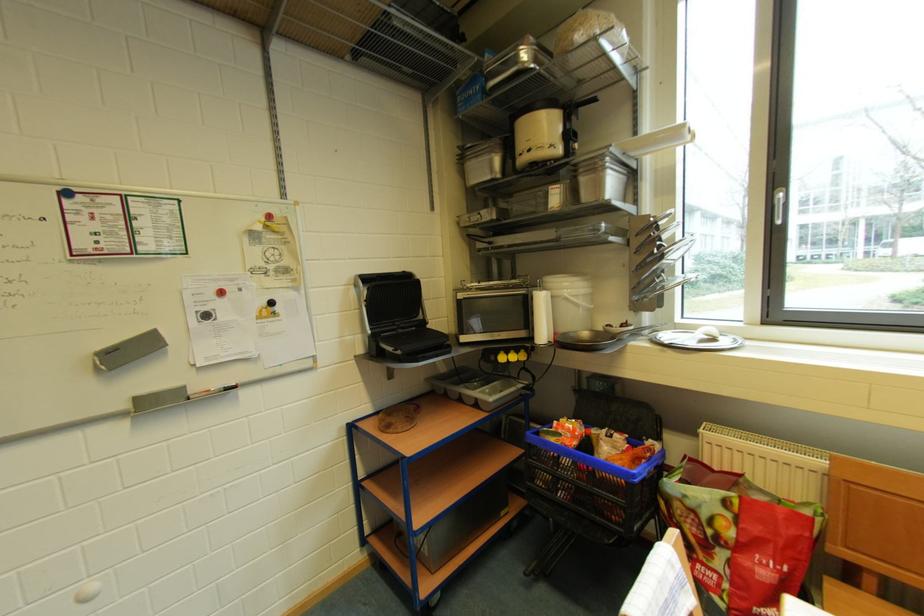
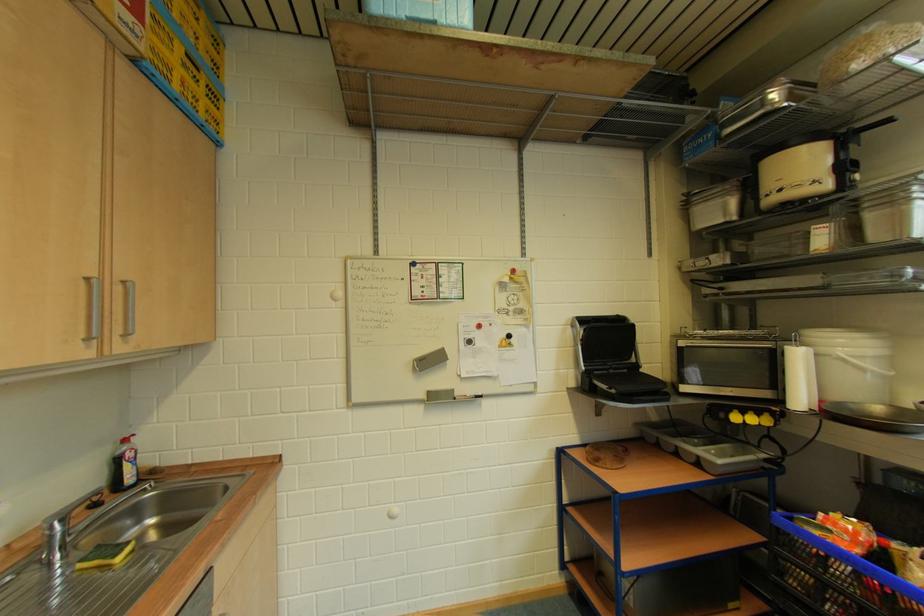
The point at (x=466, y=301) is marked in the first image. Where is the corresponding point in the second image?

(687, 347)